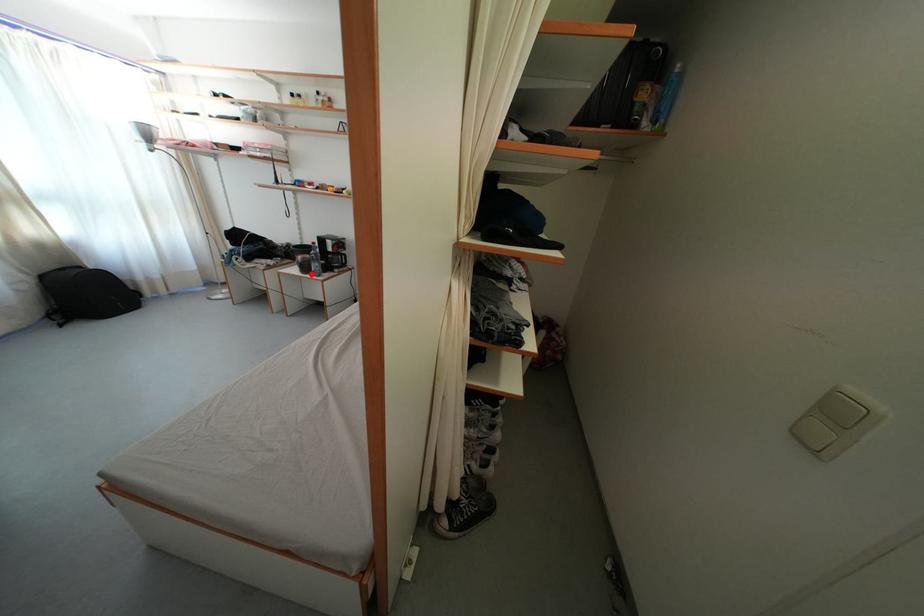
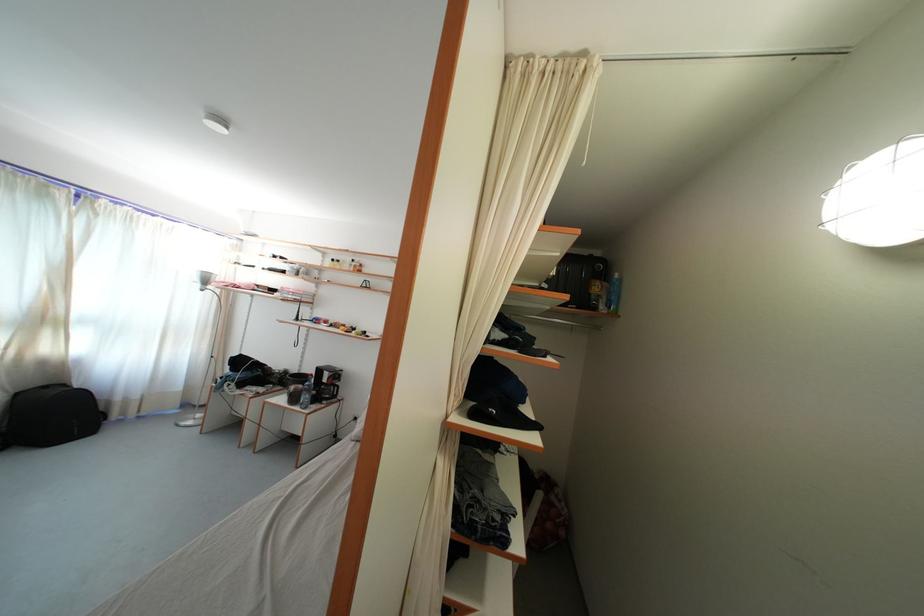
Locate, in the second image, the point that corresponds to the highlighted location in the first image.

(300, 405)